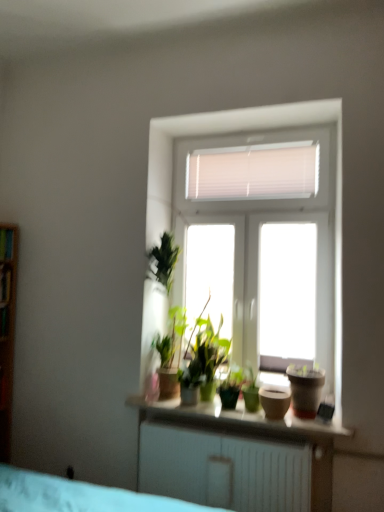
Where is `vacant space underneath matte brown pot at center, which is counted as the first flowerpot, starting from the left (from a real-world perspective)`? vacant space underneath matte brown pot at center, which is counted as the first flowerpot, starting from the left (from a real-world perspective) is located at coordinates (277, 416).